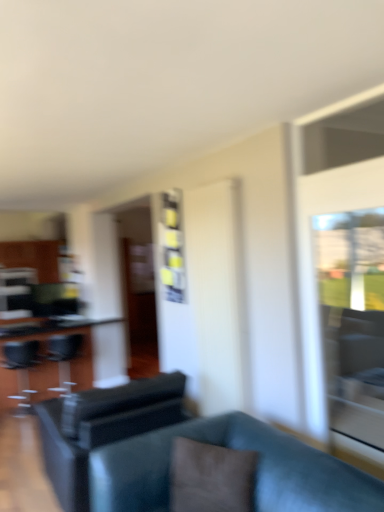
Question: Is brown fabric pillow at center bigger than black leather swivel chair at left, the 2th swivel chair in the back-to-front sequence?

Choices:
 (A) no
 (B) yes

Answer: (A)

Question: Considering the relative sizes of brown fabric pillow at center and black leather swivel chair at left, marked as the 1th swivel chair in a left-to-right arrangement, in the image provided, is brown fabric pillow at center taller than black leather swivel chair at left, marked as the 1th swivel chair in a left-to-right arrangement,?

Choices:
 (A) yes
 (B) no

Answer: (B)

Question: Is brown fabric pillow at center at the left side of black leather swivel chair at left, marked as the 1th swivel chair in a left-to-right arrangement?

Choices:
 (A) yes
 (B) no

Answer: (B)

Question: Is brown fabric pillow at center far from black leather swivel chair at left, arranged as the 3th swivel chair when viewed from the right?

Choices:
 (A) yes
 (B) no

Answer: (A)

Question: Is brown fabric pillow at center looking in the opposite direction of black leather swivel chair at left, arranged as the 3th swivel chair when viewed from the right?

Choices:
 (A) no
 (B) yes

Answer: (A)

Question: From the image's perspective, is black leather swivel chair at center, acting as the third swivel chair starting from the back, located above or below brown fabric pillow at center?

Choices:
 (A) above
 (B) below

Answer: (B)

Question: Based on their sizes in the image, would you say black leather swivel chair at center, arranged as the first swivel chair when viewed from the front, is bigger or smaller than brown fabric pillow at center?

Choices:
 (A) small
 (B) big

Answer: (B)

Question: Is black leather swivel chair at center, the 3th swivel chair when ordered from left to right, inside or outside of brown fabric pillow at center?

Choices:
 (A) inside
 (B) outside

Answer: (B)

Question: In the image, is black leather swivel chair at center, acting as the third swivel chair starting from the back, positioned in front of or behind brown fabric pillow at center?

Choices:
 (A) behind
 (B) front

Answer: (A)

Question: Does point (74, 396) appear closer or farther from the camera than point (66, 370)?

Choices:
 (A) farther
 (B) closer

Answer: (B)

Question: Is black leather swivel chair at center, which is the first swivel chair in right-to-left order, situated inside matte black swivel chair at left, which is the second swivel chair in left-to-right order, or outside?

Choices:
 (A) outside
 (B) inside

Answer: (A)

Question: Considering the positions of black leather swivel chair at center, the 3th swivel chair when ordered from left to right, and matte black swivel chair at left, which is the second swivel chair in left-to-right order, in the image, is black leather swivel chair at center, the 3th swivel chair when ordered from left to right, bigger or smaller than matte black swivel chair at left, which is the second swivel chair in left-to-right order,?

Choices:
 (A) big
 (B) small

Answer: (A)

Question: Is black leather swivel chair at center, the 3th swivel chair when ordered from left to right, in front of or behind matte black swivel chair at left, marked as the 1th swivel chair in a back-to-front arrangement, in the image?

Choices:
 (A) behind
 (B) front

Answer: (B)

Question: From the image's perspective, is brown fabric pillow at center positioned above or below black glass table at left?

Choices:
 (A) below
 (B) above

Answer: (B)

Question: Looking at their shapes, would you say brown fabric pillow at center is wider or thinner than black glass table at left?

Choices:
 (A) thin
 (B) wide

Answer: (A)